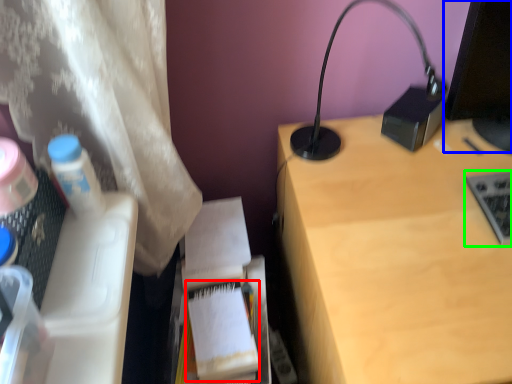
Question: Which object is the closest to the paperback book (highlighted by a red box)? Choose among these: computer screen (highlighted by a blue box) or laptop keyboard (highlighted by a green box).

Choices:
 (A) computer screen
 (B) laptop keyboard

Answer: (B)